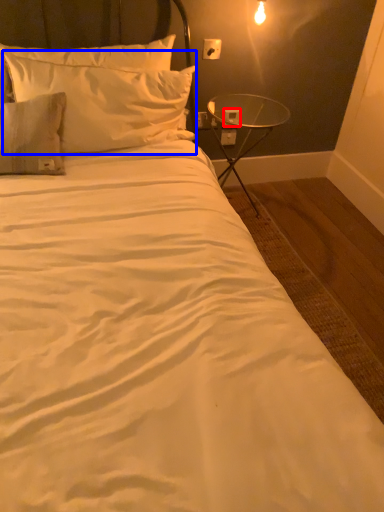
Question: Which object is closer to the camera taking this photo, electric outlet (highlighted by a red box) or pillow (highlighted by a blue box)?

Choices:
 (A) electric outlet
 (B) pillow

Answer: (B)